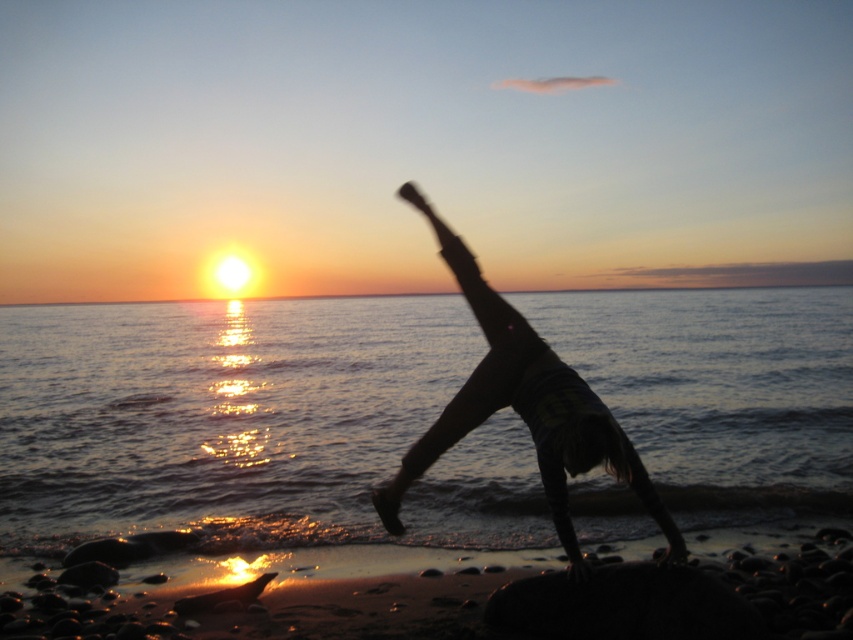
Question: Among these points, which one is farthest from the camera?

Choices:
 (A) (497, 294)
 (B) (172, 312)

Answer: (B)

Question: Considering the relative positions of glistening water at sunset right and silhouette figure at center in the image provided, where is glistening water at sunset right located with respect to silhouette figure at center?

Choices:
 (A) left
 (B) right

Answer: (B)

Question: Can you confirm if glistening water at sunset right is positioned above silhouette figure at center?

Choices:
 (A) no
 (B) yes

Answer: (B)

Question: Can you confirm if glistening water at sunset right is smaller than silhouette figure at center?

Choices:
 (A) no
 (B) yes

Answer: (A)